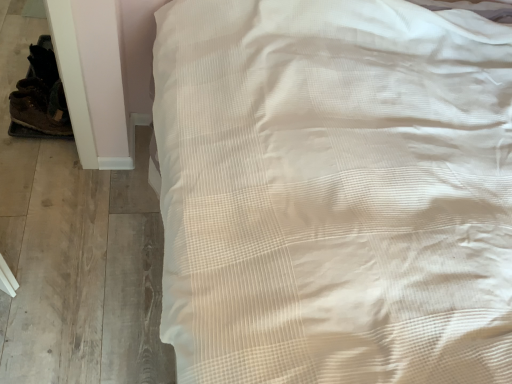
Question: Is white textured bed at upper right inside or outside of brown leather shoe at left?

Choices:
 (A) inside
 (B) outside

Answer: (B)

Question: From the image's perspective, is white textured bed at upper right located above or below brown leather shoe at left?

Choices:
 (A) below
 (B) above

Answer: (A)

Question: From a real-world perspective, is white textured bed at upper right physically located above or below brown leather shoe at left?

Choices:
 (A) below
 (B) above

Answer: (B)

Question: From a real-world perspective, is brown leather shoe at left physically located above or below white textured bed at upper right?

Choices:
 (A) above
 (B) below

Answer: (B)

Question: Considering the positions of brown leather shoe at left and white textured bed at upper right in the image, is brown leather shoe at left taller or shorter than white textured bed at upper right?

Choices:
 (A) tall
 (B) short

Answer: (B)

Question: Considering the positions of brown leather shoe at left and white textured bed at upper right in the image, is brown leather shoe at left bigger or smaller than white textured bed at upper right?

Choices:
 (A) big
 (B) small

Answer: (B)

Question: Looking at their shapes, would you say brown leather shoe at left is wider or thinner than white textured bed at upper right?

Choices:
 (A) wide
 (B) thin

Answer: (B)